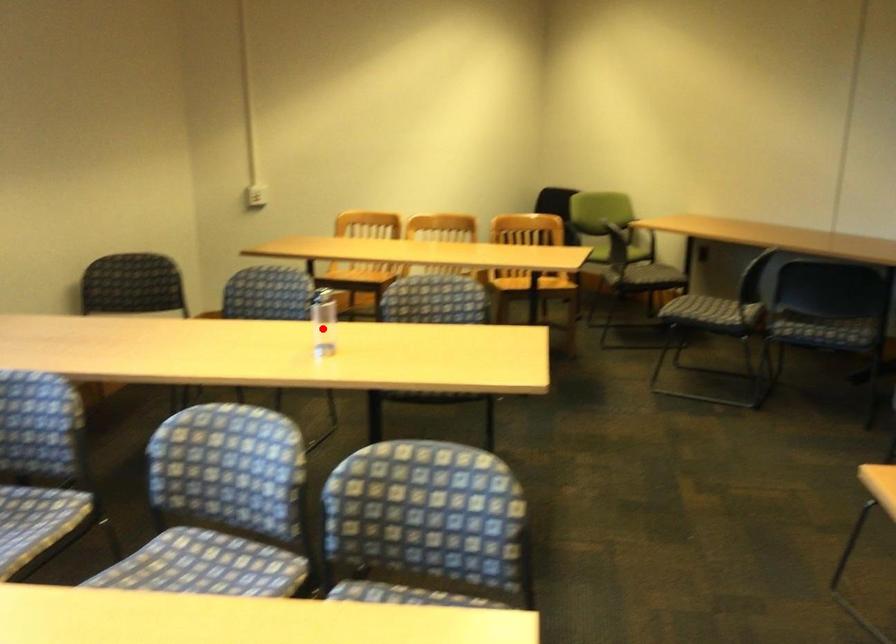
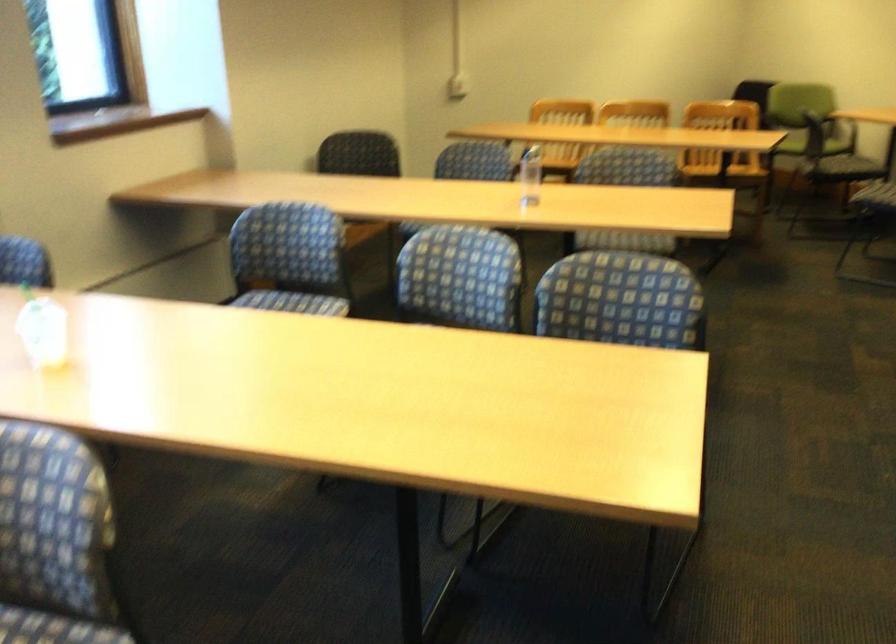
Question: I am providing you with two images of the same scene from different viewpoints. Image1 has a red point marked. In image2, the corresponding 3D location appears at what relative position? Reply with the corresponding letter.

Choices:
 (A) Closer
 (B) Farther

Answer: (B)